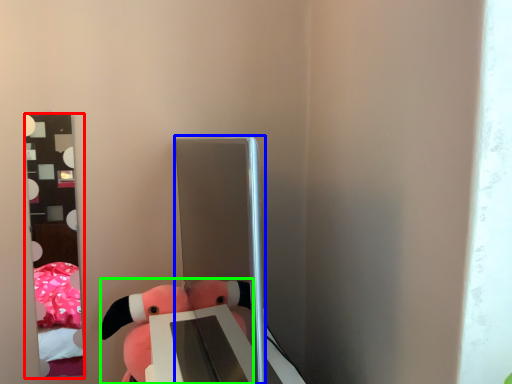
Question: Considering the real-world distances, which object is farthest from mirror (highlighted by a red box)? glass door (highlighted by a blue box) or toy (highlighted by a green box)?

Choices:
 (A) glass door
 (B) toy

Answer: (A)